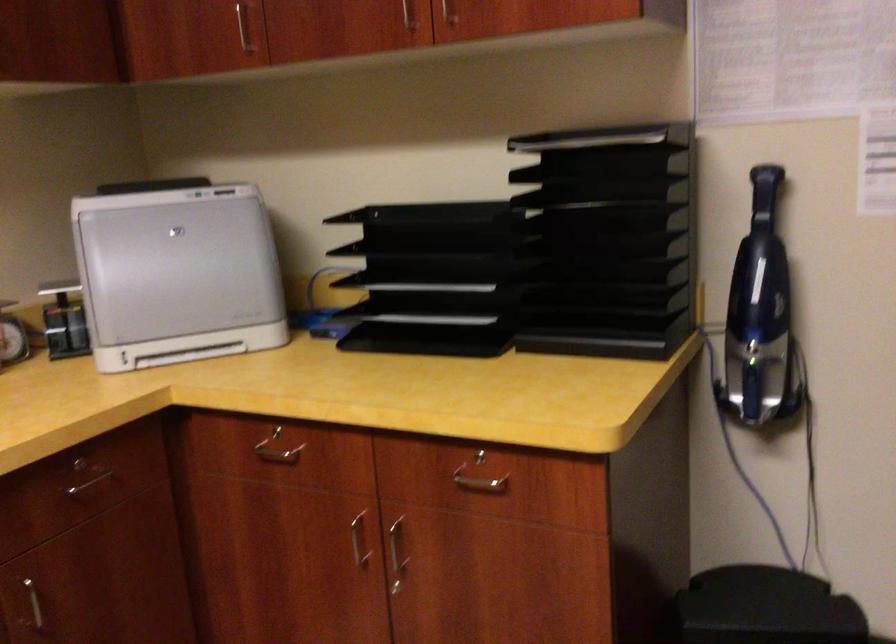
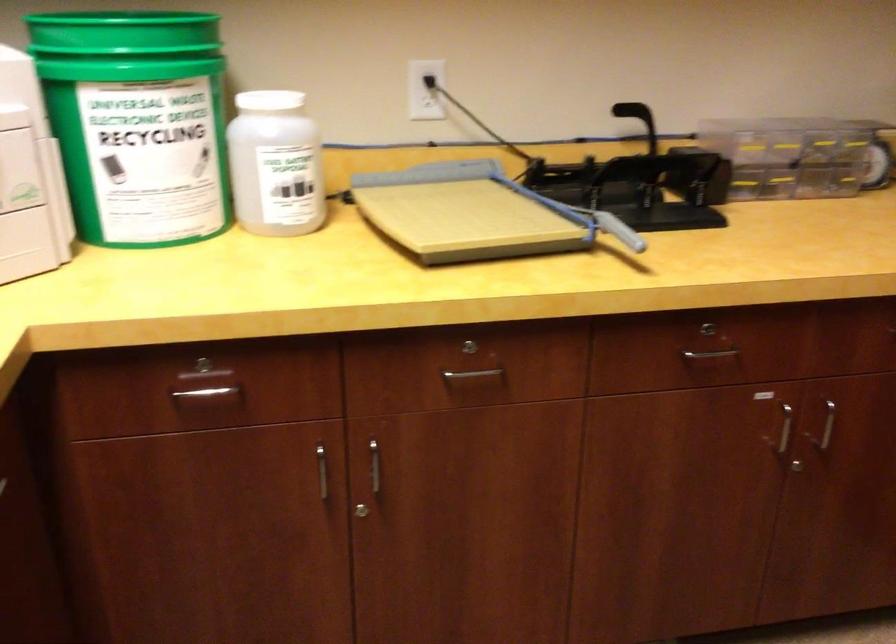
Based on the continuous images, in which direction is the camera rotating?

The camera rotated toward left-down.